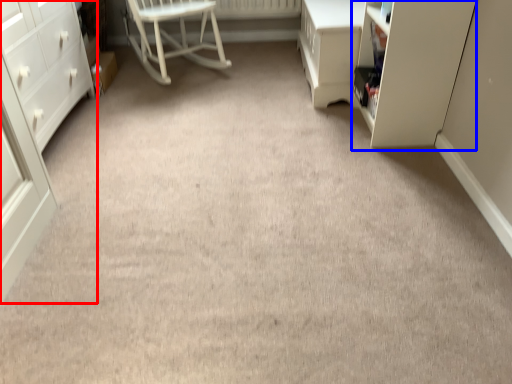
Question: Which object appears farthest to the camera in this image, chest of drawers (highlighted by a red box) or cabinetry (highlighted by a blue box)?

Choices:
 (A) chest of drawers
 (B) cabinetry

Answer: (B)